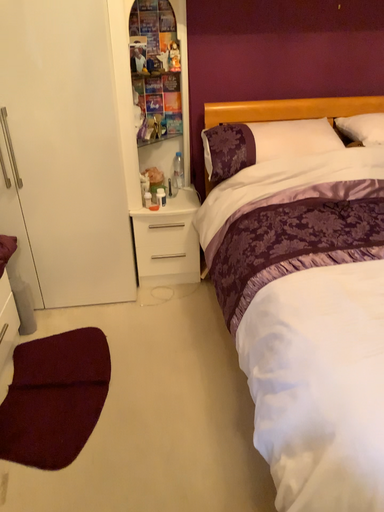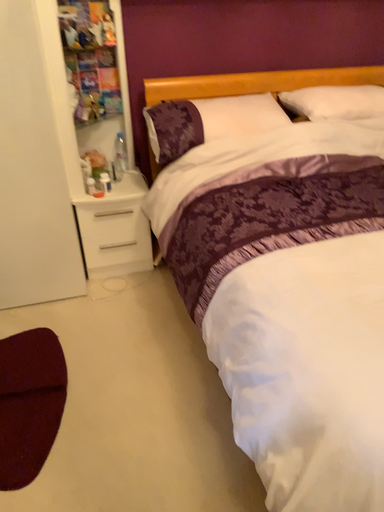
Question: Which way did the camera rotate in the video?

Choices:
 (A) rotated right
 (B) rotated left

Answer: (A)